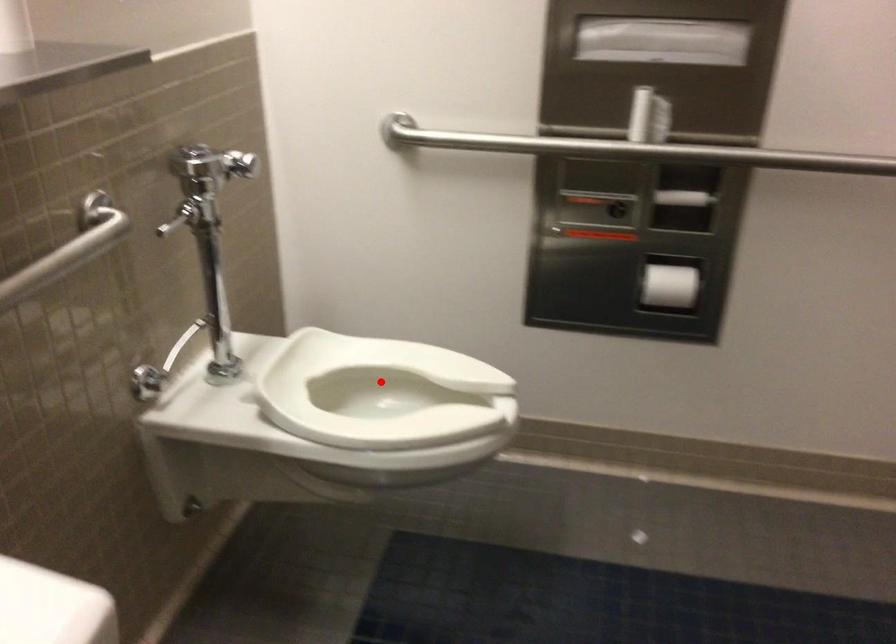
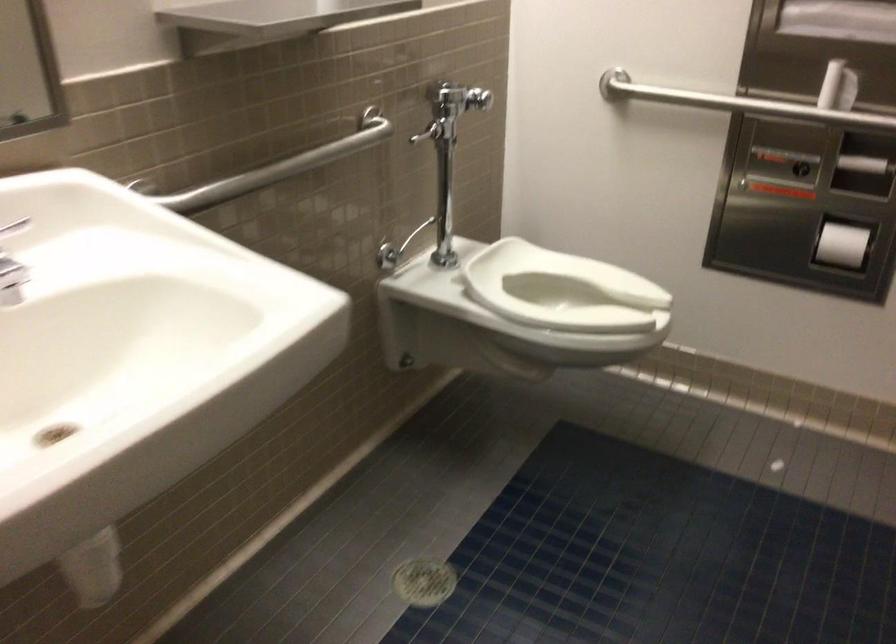
Find the pixel in the second image that matches the highlighted location in the first image.

(563, 290)